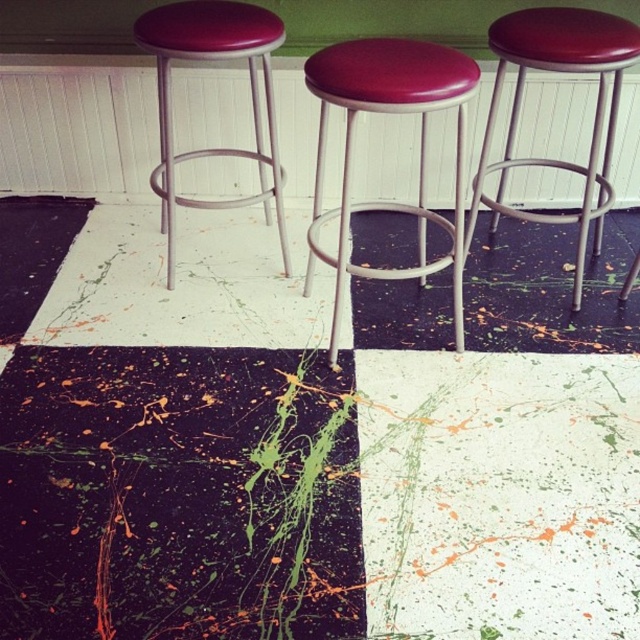
Who is lower down, matte red stool at center or matte vinyl stool at left?

matte red stool at center is below.

Can you confirm if matte red stool at center is positioned above matte vinyl stool at left?

Incorrect, matte red stool at center is not positioned above matte vinyl stool at left.

Identify the location of matte red stool at center. (419, 147).

Identify the location of matte red stool at center. The width and height of the screenshot is (640, 640). (419, 147).

Measure the distance from matte red stool at right to matte vinyl stool at left.

A distance of 36.88 inches exists between matte red stool at right and matte vinyl stool at left.

Consider the image. Between matte red stool at right and matte vinyl stool at left, which one appears on the left side from the viewer's perspective?

Positioned to the left is matte vinyl stool at left.

Who is more distant from viewer, (563,12) or (154,177)?

The point (154,177) is more distant.

Where is `matte red stool at right`? matte red stool at right is located at coordinates (557, 72).

Based on the photo, who is lower down, matte red stool at center or matte red stool at right?

Positioned lower is matte red stool at center.

Between point (460, 244) and point (563, 163), which one is positioned behind?

The point (563, 163) is more distant.

The width and height of the screenshot is (640, 640). Find the location of `matte red stool at center`. matte red stool at center is located at coordinates (419, 147).